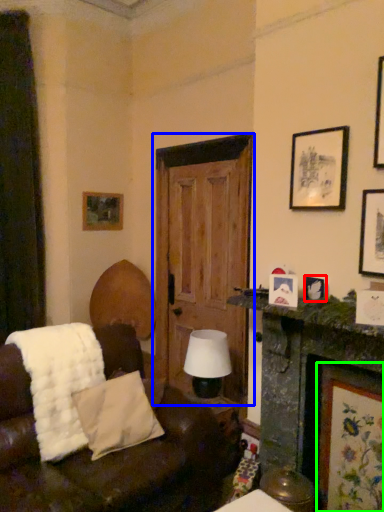
Question: Based on their relative distances, which object is nearer to picture frame (highlighted by a red box)? Choose from door (highlighted by a blue box) and picture frame (highlighted by a green box).

Choices:
 (A) door
 (B) picture frame

Answer: (B)